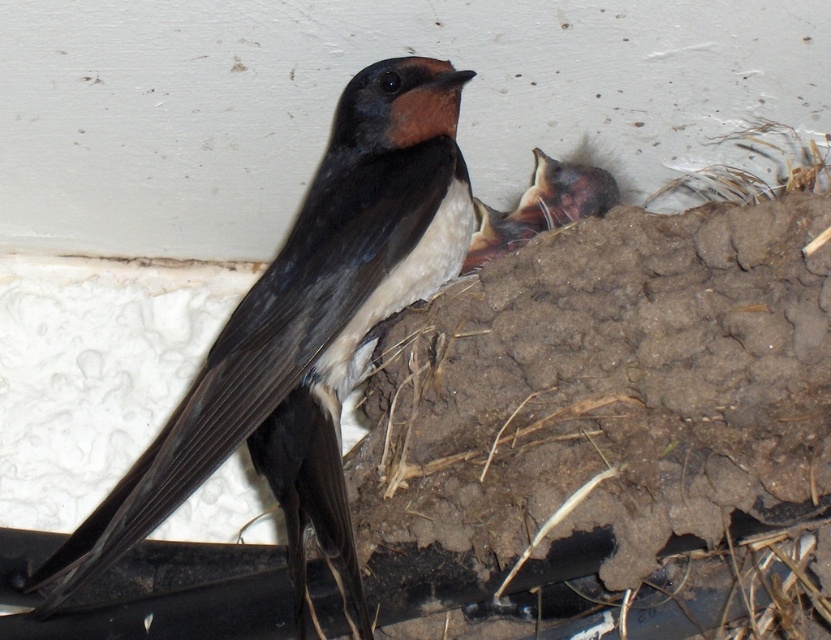
You are a wildlife photographer aiming to capture both the matte black bird at center and the brown feathered bird at center in a single frame. Given that your camera has a focal length of 50mm and the birds are 26.17 centimeters apart, what is the minimum distance you need to be from the birds to ensure both are in the frame?

The minimum distance required is approximately 26.17 centimeters divided by the camera sensor width in millimeters. However, without knowing the sensor size, an exact calculation isn